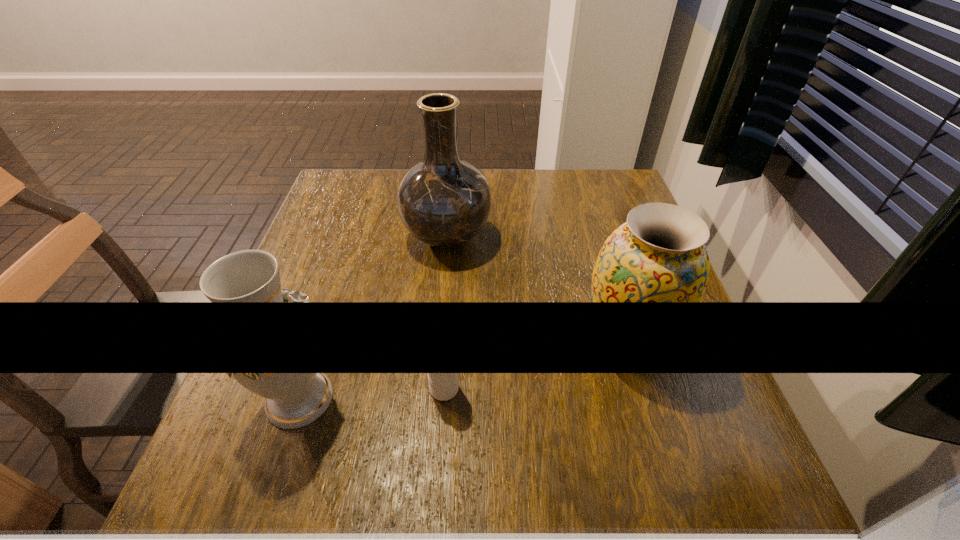
I want to click on the farthest object, so click(x=444, y=201).

Locate an element on the screen. Image resolution: width=960 pixels, height=540 pixels. the farthest vase is located at coordinates (444, 201).

Locate an element on the screen. This screenshot has height=540, width=960. the leftmost vase is located at coordinates [x=249, y=275].

The width and height of the screenshot is (960, 540). What are the coordinates of `the rightmost vase` in the screenshot? It's located at coord(659,255).

Locate an element on the screen. vacant space located 0.250m on the front of the farthest vase is located at coordinates (437, 356).

This screenshot has width=960, height=540. Find the location of `vacant space located on the back of the leftmost vase`. vacant space located on the back of the leftmost vase is located at coordinates (321, 334).

This screenshot has height=540, width=960. In order to click on free location located on the front of the rightmost object in this screenshot , I will do `click(677, 509)`.

At what (x,y) coordinates should I click in order to perform the action: click on object present at the far edge. Please return your answer as a coordinate pair (x, y). The height and width of the screenshot is (540, 960). Looking at the image, I should click on (444, 201).

Where is `object present at the left edge`? object present at the left edge is located at coordinates (249, 275).

Find the location of a particular element. This screenshot has height=540, width=960. object that is at the right edge is located at coordinates (659, 255).